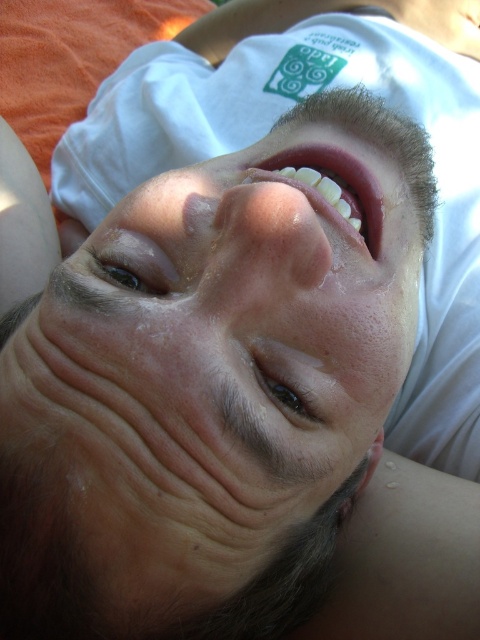
You are a photographer trying to capture the perfect shot of the person in the scene. The point at (307, 394) is where you want to focus. If the distance between the photographer and the person is 18.94 inches, can you estimate how far you should set your camera lens to focus accurately?

The distance between the photographer and the person is 18.94 inches, so you should set your camera lens to focus at approximately 18.94 inches to capture the person clearly.

You are a photographer analyzing the facial features of the person in the image. Which of the two eyes, the brown glossy eye at center or the brown shiny eye at upper center, is positioned closer to the camera?

The brown glossy eye at center is positioned closer to the camera than the brown shiny eye at upper center because it is in front of it.

Based on the scene, which object is closer to the viewer between the dry skin at center and the pink glossy lips at center?

The dry skin at center is closer to the viewer because it is positioned in front of the pink glossy lips at center.